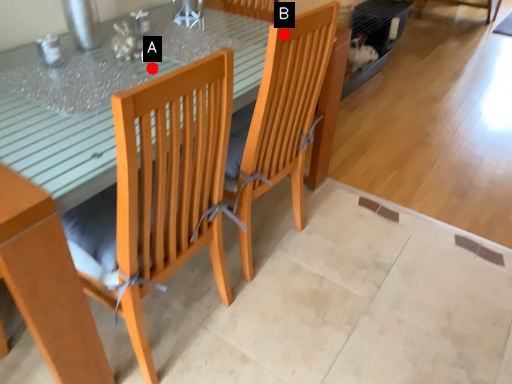
Question: Two points are circled on the image, labeled by A and B beside each circle. Which point appears farthest from the camera in this image?

Choices:
 (A) A is further
 (B) B is further

Answer: (A)